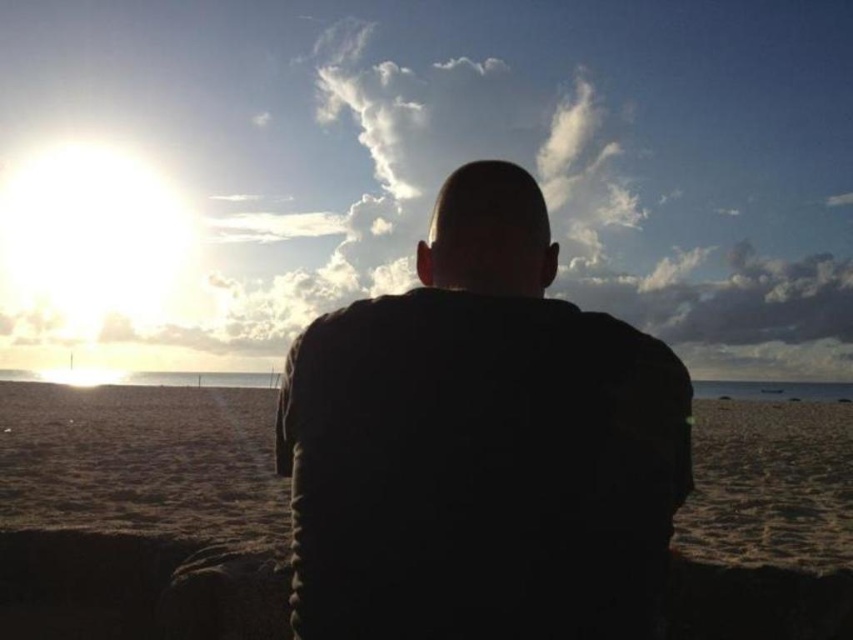
You are a photographer trying to capture the silhouette of the person wearing the black matte jacket at center against the sandy beach at center. Based on the scene description, where should you position the light source relative to the subject to achieve this effect?

The black matte jacket at center is located above sandy beach at center, so to capture the silhouette, position the light source behind the subject, such as the sun at the horizon on the left side of the frame, to have the bright light illuminate the background and create the dark outline of the jacket against the lighter sky.

You are a photographer trying to capture the silhouette of the black matte jacket at center and the sandy beach at center. Which object will appear narrower in the photo?

The black matte jacket at center will appear narrower in the photo since it is thinner than the sandy beach at center.